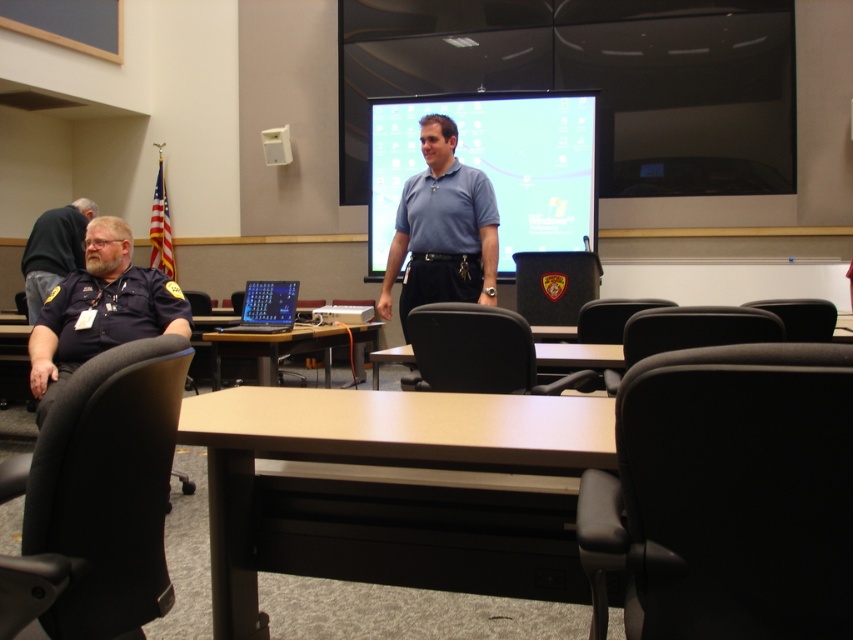
Question: Which point is farther to the camera?

Choices:
 (A) brown wooden table at center
 (B) matte blue screen at center

Answer: (B)

Question: Which point is closer to the camera?

Choices:
 (A) blue smooth shirt at center
 (B) light brown wooden table at center

Answer: (B)

Question: Is matte blue screen at center to the left of black glossy laptop at center from the viewer's perspective?

Choices:
 (A) no
 (B) yes

Answer: (A)

Question: Observing the image, what is the correct spatial positioning of matte blue screen at center in reference to brown wooden table at center?

Choices:
 (A) right
 (B) left

Answer: (A)

Question: Can you confirm if brown wooden table at center is positioned to the right of light brown wooden table at center?

Choices:
 (A) yes
 (B) no

Answer: (B)

Question: Among these points, which one is nearest to the camera?

Choices:
 (A) (335, 493)
 (B) (560, 362)
 (C) (492, 355)

Answer: (A)